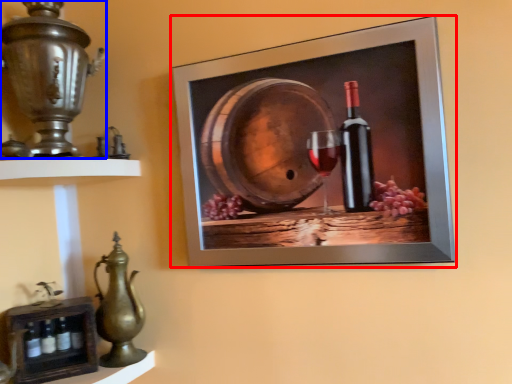
Question: Which object appears closest to the camera in this image, picture frame (highlighted by a red box) or candle holder (highlighted by a blue box)?

Choices:
 (A) picture frame
 (B) candle holder

Answer: (B)